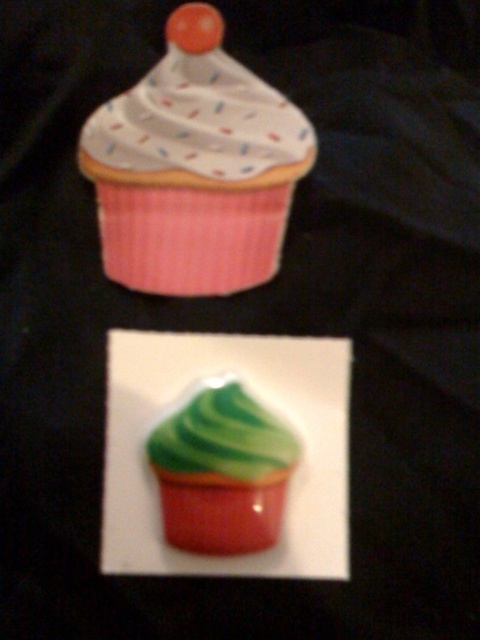
Question: Which of the following is the farthest from the observer?

Choices:
 (A) white dotted frosting at upper center
 (B) green glossy cupcake at center

Answer: (B)

Question: Which point is closer to the camera?

Choices:
 (A) matte pink cupcake at upper center
 (B) white dotted frosting at upper center
 (C) green glossy cupcake at center

Answer: (A)

Question: Is matte pink cupcake at upper center in front of white dotted frosting at upper center?

Choices:
 (A) no
 (B) yes

Answer: (B)

Question: Which of these objects is positioned closest to the matte pink cupcake at upper center?

Choices:
 (A) white dotted frosting at upper center
 (B) green glossy cupcake at center

Answer: (A)

Question: Does matte pink cupcake at upper center have a lesser width compared to white dotted frosting at upper center?

Choices:
 (A) no
 (B) yes

Answer: (B)

Question: Does white dotted frosting at upper center lie in front of green glossy cupcake at center?

Choices:
 (A) yes
 (B) no

Answer: (A)